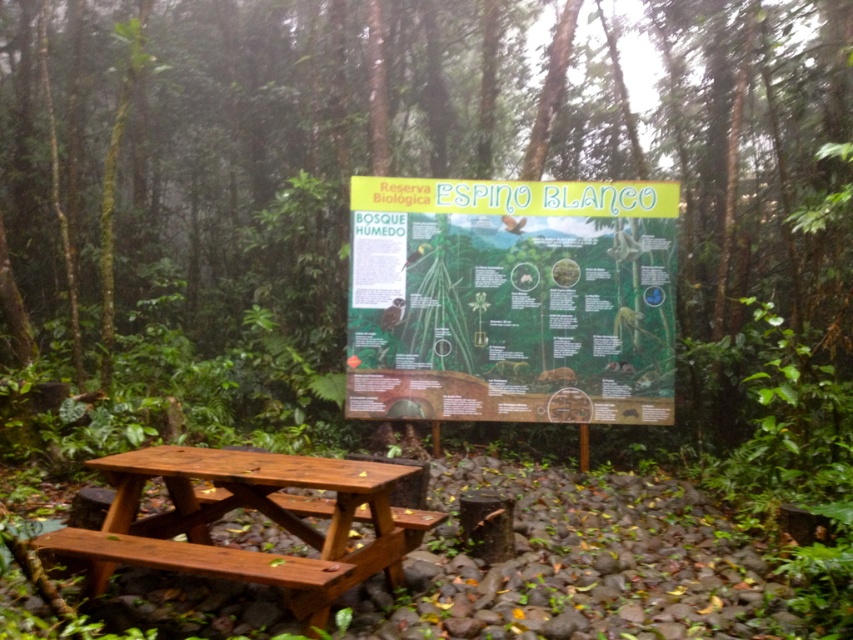
Consider the image. You are planning to set up a small picnic for two people in this forest reserve. The picnic table is already present. Considering the size of the matte green board at center and the polished wood picnic table at center, which one is more suitable for placing a large picnic basket?

The polished wood picnic table at center is more suitable for placing a large picnic basket because it is larger than the matte green board at center.

You are a park ranger who needs to place a 3.5 meter long safety barrier between the matte green board at center and the polished wood picnic table at center. Is there enough space to place the barrier between them?

The distance between the matte green board at center and the polished wood picnic table at center is 3.24 meters, which is shorter than the 3.5 meter barrier. Therefore, the barrier cannot be placed between them without overlapping the objects.